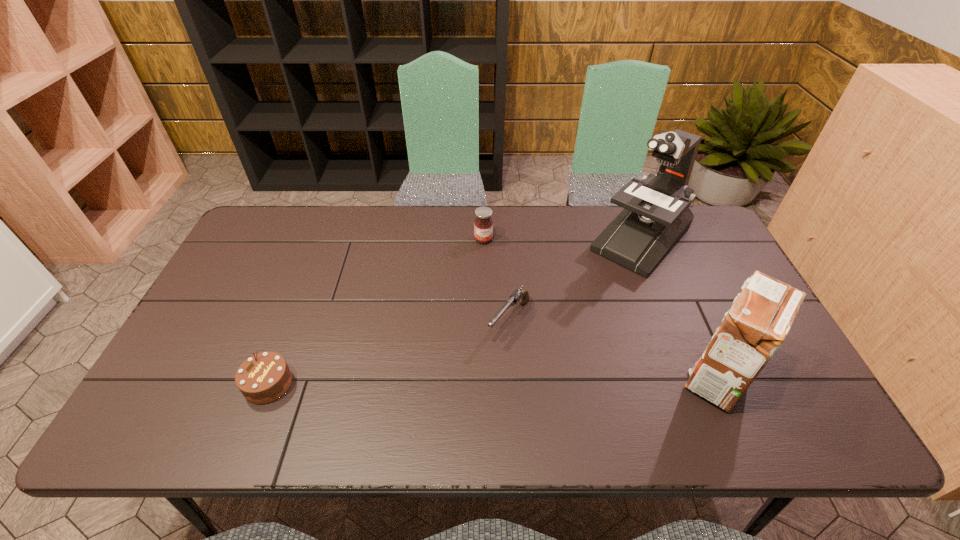
You are a GUI agent. You are given a task and a screenshot of the screen. Output one action in this format:
    pyautogui.click(x=<x>, y=<y>)
    Task: Click on the empty space that is in between the microscope and the gun
    
    Given the screenshot: What is the action you would take?
    pyautogui.click(x=575, y=280)

Where is `object that is the second closest to the gun`? The height and width of the screenshot is (540, 960). object that is the second closest to the gun is located at coordinates (483, 225).

Locate an element on the screen. object that is the closest one to the third farthest object is located at coordinates (656, 214).

This screenshot has height=540, width=960. What are the coordinates of `blank space that satisfies the following two spatial constraints: 1. on the front side of the second tallest object; 2. on the straw side of the gun` in the screenshot? It's located at (513, 378).

You are a GUI agent. You are given a task and a screenshot of the screen. Output one action in this format:
    pyautogui.click(x=<x>, y=<y>)
    Task: Click on the free location that satisfies the following two spatial constraints: 1. on the front side of the third farthest object; 2. on the right side of the third shortest object
    
    Given the screenshot: What is the action you would take?
    pyautogui.click(x=484, y=320)

Identify the location of vacant area in the image that satisfies the following two spatial constraints: 1. on the back side of the leftmost object; 2. on the left side of the microscope. The width and height of the screenshot is (960, 540). (324, 239).